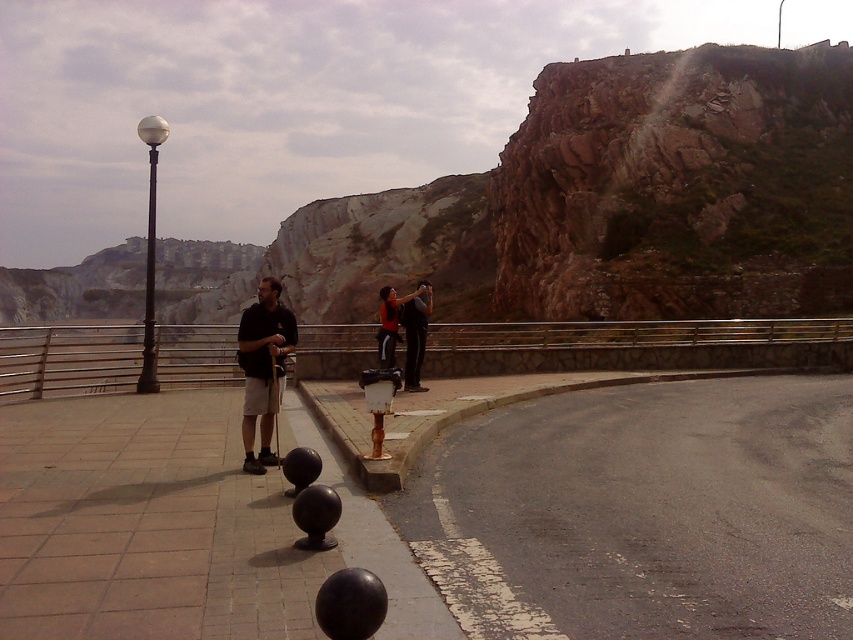
You are standing at the origin point of the coordinate system. You want to walk to the black metal bollards at center. What direction should you move in to reach them?

The black metal bollards at center are located at coordinate point 0.823 in the x direction and 0.209 in the y direction. Therefore, you should move in the positive x and positive y direction to reach them.

You are a delivery person trying to navigate through the coastal promenade. You need to pass between the black metal bollards at center and the dark gray pants at center. Considering the space between them, will your 1.2 meter wide delivery cart fit through?

The black metal bollards at center is wider than the dark gray pants at center, so the space between them may be too narrow for a 1.2 meter wide delivery cart to pass safely. You should consider an alternative route.

You are a pedestrian walking on the coastal promenade and notice the black metal bollards at center and the dark gray pants at center. Which object is closer to you?

The black metal bollards at center is closer to you because it is in front of the dark gray pants at center.